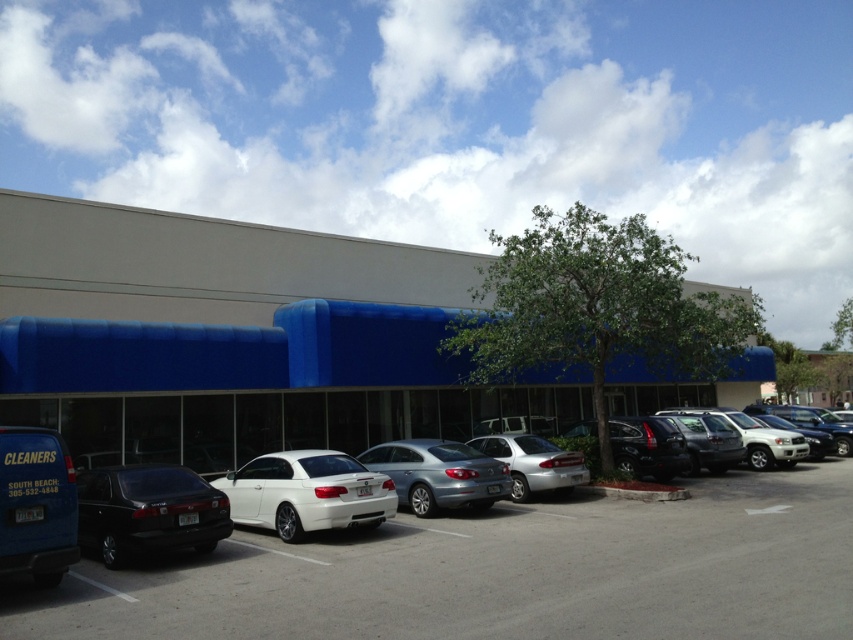
Between white glossy car at center and satin silver suv at right, which one appears on the right side from the viewer's perspective?

satin silver suv at right is more to the right.

Can you confirm if white glossy car at center is thinner than satin silver suv at right?

In fact, white glossy car at center might be wider than satin silver suv at right.

Which is in front, point (329, 500) or point (761, 429)?

Point (329, 500) is in front.

The width and height of the screenshot is (853, 640). I want to click on white glossy car at center, so click(x=306, y=492).

Does shiny black sedan at left lie behind white glossy car at center?

No, it is not.

Based on the photo, can you confirm if shiny black sedan at left is wider than white glossy car at center?

No.

Who is more forward, (80, 538) or (265, 476)?

Positioned in front is point (80, 538).

The width and height of the screenshot is (853, 640). Identify the location of shiny black sedan at left. (148, 512).

Is point (560, 458) in front of point (804, 452)?

Yes, it is.

Which is in front, point (526, 483) or point (764, 467)?

Positioned in front is point (526, 483).

Locate an element on the screen. silver metallic sedan at center is located at coordinates (532, 464).